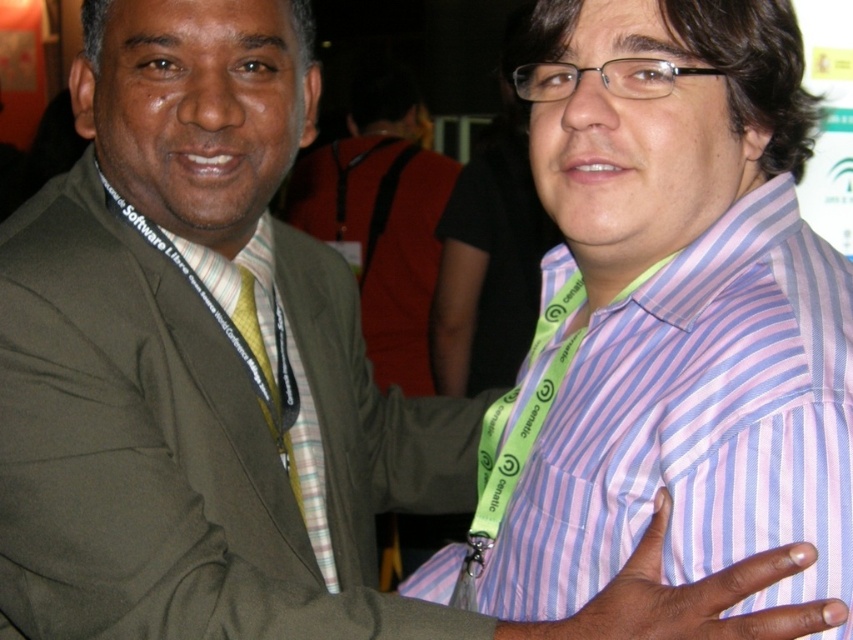
You are a photographer trying to focus on two points in this image. The first point is at coordinates point (x=12, y=260) and the second is at point (x=821, y=240). Which point is closer to you?

Point (x=12, y=260) is closer to the viewer than point (x=821, y=240).

You are a photographer trying to place a small prop at the exact coordinates of point (195, 445) in the image. Based on the scene description, where should you place the prop?

The point (195, 445) is on the green fabric suit at left, so place the prop on the green fabric suit at left.